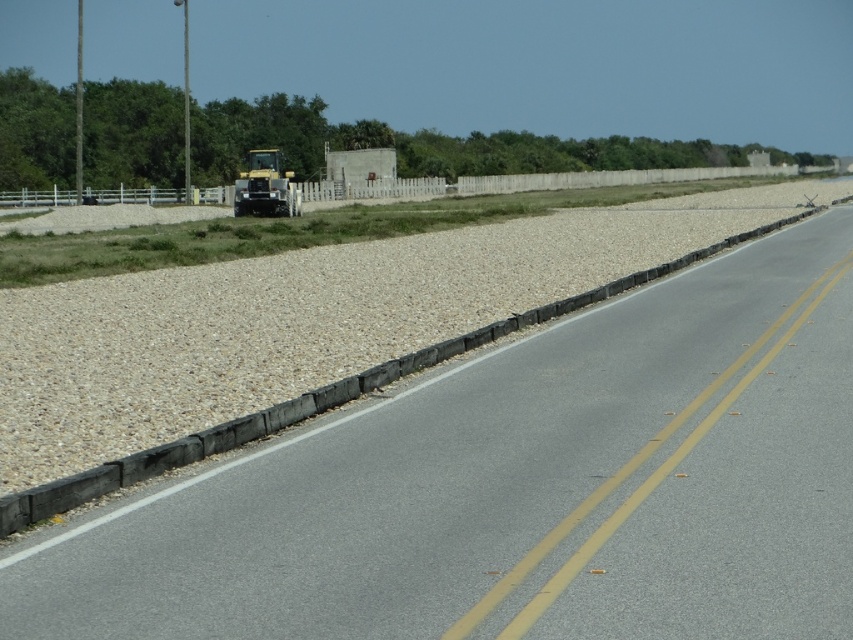
You are a delivery driver who needs to cross the asphalt road at center to reach the yellow metallic tractor at center. The road is 43.90 meters wide. Your vehicle has a maximum width of 2.5 meters. Is there enough space for your vehicle to safely pass through the road without hitting either side?

The asphalt road at center and yellow metallic tractor at center are 43.90 meters apart. Since the road is 43.90 meters wide and your vehicle is only 2.5 meters wide, there is ample space for your vehicle to safely pass through the road without hitting either side.

You are a delivery driver who needs to turn around your truck on this road. The truck requires a space twice as long as the yellow metallic tractor at center. Is there enough space on the asphalt road at center for the truck to maneuver?

The asphalt road at center occupies less space than the yellow metallic tractor at center, so the available space on the asphalt road at center is smaller than the required length needed for the truck to turn around. Therefore, there is not enough space.